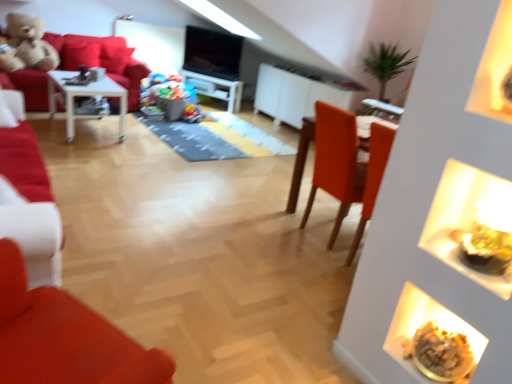
What is the approximate height of white glossy table at left, the second table in the front-to-back sequence?

21.58 inches.

What do you see at coordinates (83, 96) in the screenshot? I see `white glossy table at left, the second table in the front-to-back sequence` at bounding box center [83, 96].

The width and height of the screenshot is (512, 384). Identify the location of golden crumbly snack at lower right, positioned as the second food in left-to-right order. (440, 352).

This screenshot has width=512, height=384. What do you see at coordinates (216, 88) in the screenshot? I see `white glossy entertainment center at center` at bounding box center [216, 88].

Looking at this image, in order to face smooth plastic toy at center, arranged as the 1th food when viewed from the back, should I rotate leftwards or rightwards?

To align with it, rotate left about 8.656°.

Image resolution: width=512 pixels, height=384 pixels. What do you see at coordinates (27, 196) in the screenshot?
I see `matte white chair at left` at bounding box center [27, 196].

In order to face velvet plush teddy bear at upper left, should I rotate leftwards or rightwards?

A: To face it directly, rotate left by 23.420 degrees.

Locate an element on the screen. This screenshot has height=384, width=512. white glossy table at left, the second table in the front-to-back sequence is located at coordinates (83, 96).

Looking at this image, considering the relative sizes of fluffy beige teddy bear at upper left and matte white chair at left in the image provided, is fluffy beige teddy bear at upper left smaller than matte white chair at left?

No, fluffy beige teddy bear at upper left is not smaller than matte white chair at left.

Are fluffy beige teddy bear at upper left and matte white chair at left located far from each other?

Yes, fluffy beige teddy bear at upper left is far from matte white chair at left.

Is point (35, 63) positioned in front of point (27, 200)?

No.

Could you tell me if fluffy beige teddy bear at upper left is facing matte white chair at left?

Yes, fluffy beige teddy bear at upper left is oriented towards matte white chair at left.

From a real-world perspective, is smooth plastic toy at center, arranged as the 1th food when viewed from the back, under fluffy beige teddy bear at upper left?

Yes, from a real-world perspective, smooth plastic toy at center, arranged as the 1th food when viewed from the back, is below fluffy beige teddy bear at upper left.

This screenshot has height=384, width=512. Find the location of `food behind the fluffy beige teddy bear at upper left`. food behind the fluffy beige teddy bear at upper left is located at coordinates (192, 114).

Is point (191, 112) closer or farther from the camera than point (12, 70)?

Clearly, point (191, 112) is more distant from the camera than point (12, 70).

How distant is smooth plastic toy at center, arranged as the 1th food when viewed from the back, from fluffy beige teddy bear at upper left?

A distance of 1.99 meters exists between smooth plastic toy at center, arranged as the 1th food when viewed from the back, and fluffy beige teddy bear at upper left.

Is smooth plastic toy at center, marked as the 2th food in a bottom-to-top arrangement, in contact with golden crumbly snack at lower right, the 2th food positioned from the top?

smooth plastic toy at center, marked as the 2th food in a bottom-to-top arrangement, and golden crumbly snack at lower right, the 2th food positioned from the top, are not in contact.

How many degrees apart are the facing directions of smooth plastic toy at center, which is the 1th food in left-to-right order, and golden crumbly snack at lower right, which is the 1th food from right to left?

They differ by 112 degrees in their facing directions.

Between smooth plastic toy at center, arranged as the 1th food when viewed from the back, and golden crumbly snack at lower right, marked as the 1th food in a front-to-back arrangement, which one has more height?

Standing taller between the two is smooth plastic toy at center, arranged as the 1th food when viewed from the back.

Between golden crumbly snack at lower right, the 2th food positioned from the back, and matte orange table at center, which appears as the second table when viewed from the top, which one appears on the right side from the viewer's perspective?

From the viewer's perspective, golden crumbly snack at lower right, the 2th food positioned from the back, appears more on the right side.

Is golden crumbly snack at lower right, the 2th food positioned from the back, inside the boundaries of matte orange table at center, the 2th table viewed from the back, or outside?

golden crumbly snack at lower right, the 2th food positioned from the back, exists outside the volume of matte orange table at center, the 2th table viewed from the back.

Considering the points (468, 351) and (296, 175), which point is behind, point (468, 351) or point (296, 175)?

The point (296, 175) is behind.

From a real-world perspective, starting from the matte orange table at center, the first table positioned from the bottom, which food is the 1st one below it? Please provide its 2D coordinates.

[(440, 352)]

From a real-world perspective, is white glossy entertainment center at center located higher than velvet plush teddy bear at upper left?

No, from a real-world perspective, white glossy entertainment center at center is not on top of velvet plush teddy bear at upper left.

Consider the image. Which of these two, white glossy entertainment center at center or velvet plush teddy bear at upper left, stands shorter?

white glossy entertainment center at center.

How many degrees apart are the facing directions of white glossy entertainment center at center and velvet plush teddy bear at upper left?

146 degrees.

Is white glossy entertainment center at center at the left side of velvet plush teddy bear at upper left?

In fact, white glossy entertainment center at center is to the right of velvet plush teddy bear at upper left.

Considering the sizes of objects white glossy table at left, acting as the 2th table starting from the bottom, and velvet plush teddy bear at upper left in the image provided, who is shorter, white glossy table at left, acting as the 2th table starting from the bottom, or velvet plush teddy bear at upper left?

With less height is white glossy table at left, acting as the 2th table starting from the bottom.

I want to click on studio couch lying on the left of white glossy table at left, which is the second table in right-to-left order, so click(102, 60).

Measure the distance from white glossy table at left, acting as the 2th table starting from the bottom, to velvet plush teddy bear at upper left.

white glossy table at left, acting as the 2th table starting from the bottom, is 22.87 inches away from velvet plush teddy bear at upper left.

From the image's perspective, is white glossy table at left, which is the second table in right-to-left order, located above velvet plush teddy bear at upper left?

Incorrect, from the image's perspective, white glossy table at left, which is the second table in right-to-left order, is lower than velvet plush teddy bear at upper left.

From the image's perspective, who appears lower, white glossy table at left, which is the 1th table in top-to-bottom order, or white glossy entertainment center at center?

white glossy table at left, which is the 1th table in top-to-bottom order, appears lower in the image.

Starting from the white glossy entertainment center at center, which table is the 1st one in front? Please provide its 2D coordinates.

[(83, 96)]

Is white glossy table at left, the first table from the back, closer to camera compared to white glossy entertainment center at center?

Yes, it is.

Where is `chair that is below the fluffy beige teddy bear at upper left (from the image's perspective)`? chair that is below the fluffy beige teddy bear at upper left (from the image's perspective) is located at coordinates (27, 196).

Find the location of a particular element. The height and width of the screenshot is (384, 512). food behind the fluffy beige teddy bear at upper left is located at coordinates (192, 114).

Looking at the image, which one is located further to matte orange table at center, the 2th table in the left-to-right sequence, smooth plastic toy at center, the second food viewed from the right, or velvet plush teddy bear at upper left?

The object further to matte orange table at center, the 2th table in the left-to-right sequence, is velvet plush teddy bear at upper left.

When comparing their distances from white glossy table at left, acting as the 2th table starting from the bottom, does velvet plush teddy bear at upper left or matte orange table at center, the first table positioned from the bottom, seem further?

matte orange table at center, the first table positioned from the bottom, is further to white glossy table at left, acting as the 2th table starting from the bottom.

Which object lies further to the anchor point white glossy entertainment center at center, matte white chair at left or fluffy beige teddy bear at upper left?

matte white chair at left.

Considering their positions, is golden crumbly snack at lower right, which is the 1th food from right to left, positioned closer to white glossy table at left, acting as the 2th table starting from the bottom, than fluffy beige teddy bear at upper left?

The object closer to white glossy table at left, acting as the 2th table starting from the bottom, is fluffy beige teddy bear at upper left.

From the image, which object appears to be farther from golden crumbly snack at lower right, marked as the 1th food in a front-to-back arrangement, smooth plastic toy at center, the second food viewed from the right, or matte white chair at left?

Among the two, smooth plastic toy at center, the second food viewed from the right, is located further to golden crumbly snack at lower right, marked as the 1th food in a front-to-back arrangement.

When comparing their distances from velvet plush teddy bear at upper left, does white glossy entertainment center at center or smooth plastic toy at center, which appears as the 2th food when viewed from the front, seem closer?

Among the two, smooth plastic toy at center, which appears as the 2th food when viewed from the front, is located nearer to velvet plush teddy bear at upper left.

When comparing their distances from fluffy beige teddy bear at upper left, does velvet plush teddy bear at upper left or matte orange table at center, acting as the 1th table starting from the front, seem further?

matte orange table at center, acting as the 1th table starting from the front, lies further to fluffy beige teddy bear at upper left than the other object.

Looking at the image, which one is located closer to golden crumbly snack at lower right, which is the 1th food from right to left, white glossy entertainment center at center or matte white chair at left?

Based on the image, matte white chair at left appears to be nearer to golden crumbly snack at lower right, which is the 1th food from right to left.

Image resolution: width=512 pixels, height=384 pixels. What are the coordinates of `toy positioned between matte white chair at left and velvet plush teddy bear at upper left from near to far` in the screenshot? It's located at (27, 45).

Where is `toy between white glossy table at left, the first table from the back, and white glossy entertainment center at center from front to back`? The image size is (512, 384). toy between white glossy table at left, the first table from the back, and white glossy entertainment center at center from front to back is located at coordinates (27, 45).

Where is `table between matte orange table at center, which appears as the second table when viewed from the top, and smooth plastic toy at center, which appears as the 2th food when viewed from the front, from front to back`? The image size is (512, 384). table between matte orange table at center, which appears as the second table when viewed from the top, and smooth plastic toy at center, which appears as the 2th food when viewed from the front, from front to back is located at coordinates (83, 96).

You are a GUI agent. You are given a task and a screenshot of the screen. Output one action in this format:
    pyautogui.click(x=<x>, y=<y>)
    Task: Click on the food between fluffy beige teddy bear at upper left and white glossy entertainment center at center
    The width and height of the screenshot is (512, 384).
    Given the screenshot: What is the action you would take?
    (x=192, y=114)